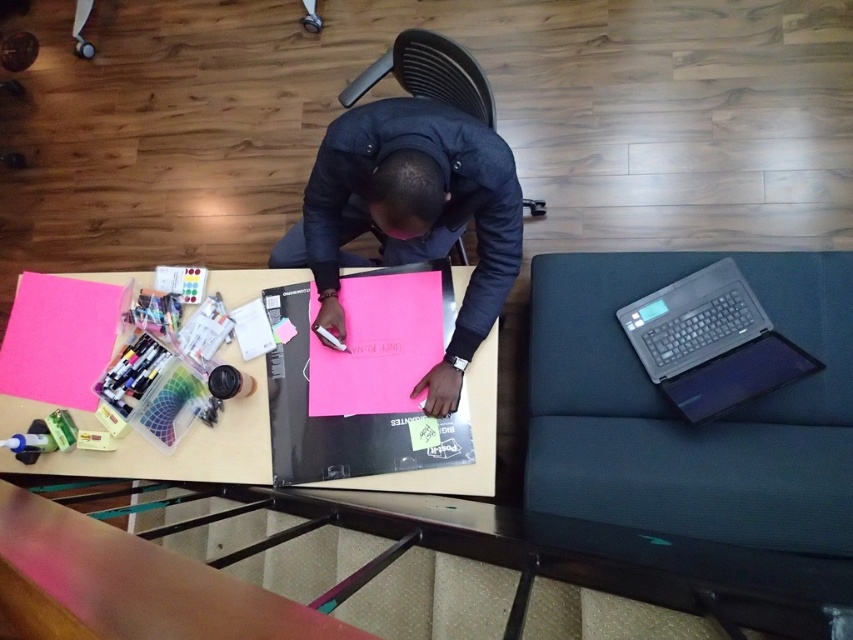
Between black fabric swivel chair at lower right and black plastic chair at center, which one appears on the right side from the viewer's perspective?

From the viewer's perspective, black fabric swivel chair at lower right appears more on the right side.

Does black fabric swivel chair at lower right have a greater width compared to black plastic chair at center?

Yes.

The height and width of the screenshot is (640, 853). What are the coordinates of `black fabric swivel chair at lower right` in the screenshot? It's located at (683, 419).

Does black fabric swivel chair at lower right come behind sleek silver laptop at right?

No, black fabric swivel chair at lower right is in front of sleek silver laptop at right.

In the scene shown: Is black fabric swivel chair at lower right to the right of sleek silver laptop at right from the viewer's perspective?

No, black fabric swivel chair at lower right is not to the right of sleek silver laptop at right.

What do you see at coordinates (683, 419) in the screenshot?
I see `black fabric swivel chair at lower right` at bounding box center [683, 419].

Where is `black fabric swivel chair at lower right`? The width and height of the screenshot is (853, 640). black fabric swivel chair at lower right is located at coordinates (683, 419).

Is point (701, 269) farther from camera compared to point (469, 106)?

Yes.

Does point (805, 368) lie behind point (473, 67)?

Yes, it is behind point (473, 67).

The height and width of the screenshot is (640, 853). Identify the location of sleek silver laptop at right. (711, 342).